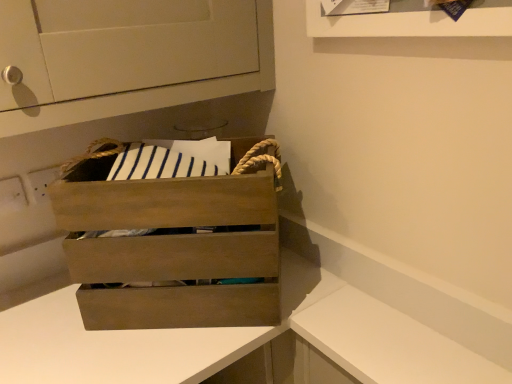
The image size is (512, 384). Find the location of `wooden crate at center, which is the 2th counter in right-to-left order`. wooden crate at center, which is the 2th counter in right-to-left order is located at coordinates (112, 347).

Measure the distance between wooden crate at center and white matte counter at lower right, placed as the first counter when sorted from right to left.

wooden crate at center is 7.65 inches away from white matte counter at lower right, placed as the first counter when sorted from right to left.

Could white matte counter at lower right, placed as the first counter when sorted from right to left, be considered to be inside wooden crate at center?

Actually, white matte counter at lower right, placed as the first counter when sorted from right to left, is outside wooden crate at center.

Is point (83, 193) closer to viewer compared to point (207, 342)?

Yes.

Which object is positioned more to the right, wooden crate at center or white matte counter at lower right, placed as the first counter when sorted from right to left?

white matte counter at lower right, placed as the first counter when sorted from right to left, is more to the right.

From a real-world perspective, is wooden crate at center, which is the 2th counter in right-to-left order, positioned over wooden crate at center based on gravity?

No, from a real-world perspective, wooden crate at center, which is the 2th counter in right-to-left order, is not over wooden crate at center

Consider the image. Based on their sizes in the image, would you say wooden crate at center, the 1th counter in the left-to-right sequence, is bigger or smaller than wooden crate at center?

In the image, wooden crate at center, the 1th counter in the left-to-right sequence, appears to be larger than wooden crate at center.

Which object is further away from the camera taking this photo, wooden crate at center, the 1th counter in the left-to-right sequence, or wooden crate at center?

wooden crate at center is further away from the camera.

Which of these two, white matte counter at lower right, placed as the 2th counter when sorted from left to right, or wooden crate at center, stands shorter?

Standing shorter between the two is wooden crate at center.

Considering the positions of points (432, 323) and (190, 213), is point (432, 323) farther from camera compared to point (190, 213)?

Yes, point (432, 323) is behind point (190, 213).

Which object is positioned more to the left, white matte counter at lower right, placed as the first counter when sorted from right to left, or wooden crate at center?

From the viewer's perspective, wooden crate at center appears more on the left side.

Who is smaller, wooden crate at center, the 1th counter in the left-to-right sequence, or white matte counter at lower right, placed as the 2th counter when sorted from left to right?

Smaller between the two is white matte counter at lower right, placed as the 2th counter when sorted from left to right.

Is wooden crate at center, the 1th counter in the left-to-right sequence, next to white matte counter at lower right, placed as the first counter when sorted from right to left?

Indeed, wooden crate at center, the 1th counter in the left-to-right sequence, and white matte counter at lower right, placed as the first counter when sorted from right to left, are beside each other and touching.

In the scene shown: Considering the sizes of wooden crate at center, which is the 2th counter in right-to-left order, and white matte counter at lower right, placed as the 2th counter when sorted from left to right, in the image, is wooden crate at center, which is the 2th counter in right-to-left order, taller or shorter than white matte counter at lower right, placed as the 2th counter when sorted from left to right,?

Considering their sizes, wooden crate at center, which is the 2th counter in right-to-left order, has more height than white matte counter at lower right, placed as the 2th counter when sorted from left to right.

Is there a large distance between wooden crate at center and wooden crate at center, which is the 2th counter in right-to-left order?

That's not correct — wooden crate at center is a little close to wooden crate at center, which is the 2th counter in right-to-left order.

Between wooden crate at center and wooden crate at center, the 1th counter in the left-to-right sequence, which one has smaller size?

With smaller size is wooden crate at center.

From the picture: Which is in front, wooden crate at center or wooden crate at center, the 1th counter in the left-to-right sequence?

Positioned in front is wooden crate at center, the 1th counter in the left-to-right sequence.

From a real-world perspective, relative to wooden crate at center, the 1th counter in the left-to-right sequence, is wooden crate at center vertically above or below?

From a real-world perspective, wooden crate at center is physically above wooden crate at center, the 1th counter in the left-to-right sequence.

Consider the image. Is white matte counter at lower right, placed as the first counter when sorted from right to left, far from wooden crate at center, which is the 2th counter in right-to-left order?

No.

Can you confirm if white matte counter at lower right, placed as the 2th counter when sorted from left to right, is positioned to the left of wooden crate at center, the 1th counter in the left-to-right sequence?

Incorrect, white matte counter at lower right, placed as the 2th counter when sorted from left to right, is not on the left side of wooden crate at center, the 1th counter in the left-to-right sequence.

Is white matte counter at lower right, placed as the first counter when sorted from right to left, aimed at wooden crate at center, which is the 2th counter in right-to-left order?

Yes.

Find the location of a particular element. This screenshot has width=512, height=384. counter that appears below the white matte counter at lower right, placed as the first counter when sorted from right to left (from the image's perspective) is located at coordinates (112, 347).

From the wooden crate at center, count 2nd counters forward and point to it. Please provide its 2D coordinates.

[(389, 315)]

From the image's perspective, which counter is the 2nd one below the wooden crate at center? Please provide its 2D coordinates.

[(112, 347)]

Looking at the image, which one is located further to wooden crate at center, wooden crate at center, which is the 2th counter in right-to-left order, or white matte counter at lower right, placed as the 2th counter when sorted from left to right?

Among the two, white matte counter at lower right, placed as the 2th counter when sorted from left to right, is located further to wooden crate at center.

Based on the photo, from the image, which object appears to be nearer to wooden crate at center, which is the 2th counter in right-to-left order, wooden crate at center or white matte counter at lower right, placed as the first counter when sorted from right to left?

white matte counter at lower right, placed as the first counter when sorted from right to left.

When comparing their distances from wooden crate at center, the 1th counter in the left-to-right sequence, does white matte counter at lower right, placed as the 2th counter when sorted from left to right, or wooden crate at center seem closer?

white matte counter at lower right, placed as the 2th counter when sorted from left to right, is closer to wooden crate at center, the 1th counter in the left-to-right sequence.

Which object lies nearer to the anchor point white matte counter at lower right, placed as the 2th counter when sorted from left to right, wooden crate at center or wooden crate at center, which is the 2th counter in right-to-left order?

The object closer to white matte counter at lower right, placed as the 2th counter when sorted from left to right, is wooden crate at center, which is the 2th counter in right-to-left order.

When comparing their distances from wooden crate at center, does white matte counter at lower right, placed as the 2th counter when sorted from left to right, or wooden crate at center, the 1th counter in the left-to-right sequence, seem further?

white matte counter at lower right, placed as the 2th counter when sorted from left to right, lies further to wooden crate at center than the other object.

From the image, which object appears to be farther from white matte counter at lower right, placed as the 2th counter when sorted from left to right, wooden crate at center, the 1th counter in the left-to-right sequence, or wooden crate at center?

wooden crate at center.

Locate an element on the screen. The image size is (512, 384). counter between wooden crate at center and wooden crate at center, the 1th counter in the left-to-right sequence, vertically is located at coordinates (389, 315).